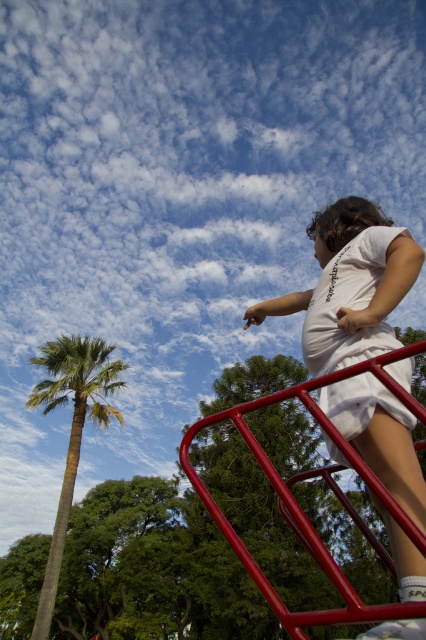
Is white cotton shirt at upper right positioned behind white cotton dress at upper right?

No, it is in front of white cotton dress at upper right.

Who is more forward, (417, 557) or (348, 401)?

Point (417, 557)

What do you see at coordinates (350, 285) in the screenshot?
I see `white cotton shirt at upper right` at bounding box center [350, 285].

Locate an element on the screen. The width and height of the screenshot is (426, 640). white cotton shirt at upper right is located at coordinates (350, 285).

Is point (356, 445) positioned before point (60, 364)?

Yes, point (356, 445) is in front of point (60, 364).

Can you confirm if white cotton shirt at upper right is positioned to the left of green leafy palm at left?

In fact, white cotton shirt at upper right is to the right of green leafy palm at left.

Where is `white cotton shirt at upper right`? white cotton shirt at upper right is located at coordinates (350, 285).

Does white cotton dress at upper right appear under green leafy palm at left?

Incorrect, white cotton dress at upper right is not positioned below green leafy palm at left.

Who is lower down, white cotton dress at upper right or green leafy palm at left?

green leafy palm at left is below.

Does point (388, 232) come closer to viewer compared to point (69, 496)?

Yes, point (388, 232) is closer to viewer.

At what (x,y) coordinates should I click in order to perform the action: click on white cotton dress at upper right. Please return your answer as a coordinate pair (x, y). This screenshot has width=426, height=640. Looking at the image, I should click on (348, 305).